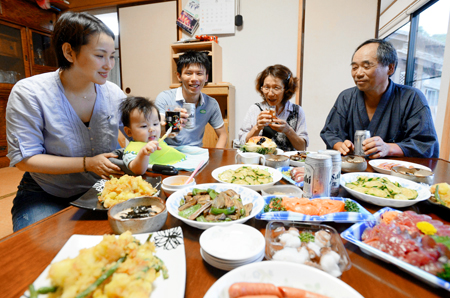
This screenshot has height=298, width=450. In order to click on white wall in this screenshot , I will do `click(281, 53)`.